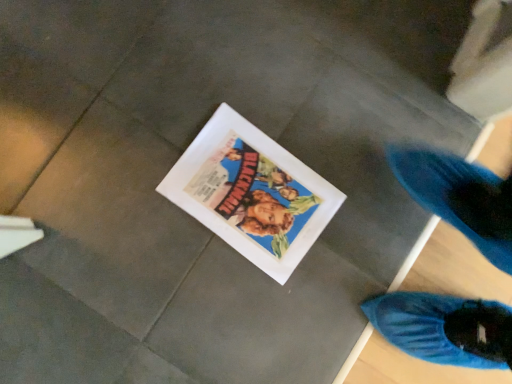
This screenshot has height=384, width=512. What do you see at coordinates (252, 193) in the screenshot? I see `matte paper comic book at center` at bounding box center [252, 193].

What is the approximate width of matte paper comic book at center?

It is 30.64 centimeters.

I want to click on matte paper comic book at center, so click(252, 193).

The image size is (512, 384). I want to click on matte paper comic book at center, so click(252, 193).